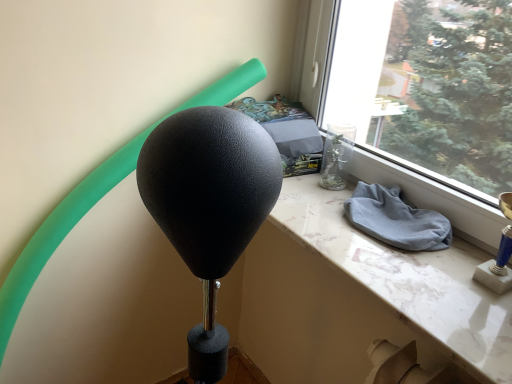
The width and height of the screenshot is (512, 384). Describe the element at coordinates (396, 219) in the screenshot. I see `gray cotton cloth at window sill` at that location.

Image resolution: width=512 pixels, height=384 pixels. Find the location of `gray cotton cloth at window sill`. gray cotton cloth at window sill is located at coordinates (396, 219).

What do you see at coordinates (361, 298) in the screenshot?
I see `white marble table at center` at bounding box center [361, 298].

You are a GUI agent. You are given a task and a screenshot of the screen. Output one action in this format:
    pyautogui.click(x=<x>, y=<y>)
    Task: Click on the white marble table at center
    The height and width of the screenshot is (384, 512).
    Given the screenshot: What is the action you would take?
    pyautogui.click(x=361, y=298)

From the picture: What is the approximate height of white marble table at center?

white marble table at center is 7.51 centimeters in height.

In order to face white marble table at center, should I rotate leftwards or rightwards?

Rotate right and turn 13.744 degrees.

This screenshot has width=512, height=384. Identify the location of gray cotton cloth at window sill. (396, 219).

Can you confirm if white marble table at center is positioned to the right of gray cotton cloth at window sill?

In fact, white marble table at center is to the left of gray cotton cloth at window sill.

Considering their positions, is white marble table at center located in front of or behind gray cotton cloth at window sill?

white marble table at center is in front of gray cotton cloth at window sill.

Is point (368, 314) in front of point (367, 207)?

No.

From the image's perspective, is white marble table at center below gray cotton cloth at window sill?

Yes, from the image's perspective, white marble table at center is below gray cotton cloth at window sill.

From a real-world perspective, does white marble table at center stand above gray cotton cloth at window sill?

No, from a real-world perspective, white marble table at center is not on top of gray cotton cloth at window sill.

Looking at their sizes, would you say white marble table at center is wider or thinner than gray cotton cloth at window sill?

In the image, white marble table at center appears to be wider than gray cotton cloth at window sill.

Is white marble table at center shorter than gray cotton cloth at window sill?

Correct, white marble table at center is not as tall as gray cotton cloth at window sill.

Considering the sizes of objects white marble table at center and gray cotton cloth at window sill in the image provided, who is bigger, white marble table at center or gray cotton cloth at window sill?

white marble table at center is bigger.

Is white marble table at center positioned beyond the bounds of gray cotton cloth at window sill?

white marble table at center is positioned outside gray cotton cloth at window sill.

Can you see white marble table at center touching gray cotton cloth at window sill?

No, white marble table at center is not making contact with gray cotton cloth at window sill.

Is gray cotton cloth at window sill at the back of white marble table at center?

No, gray cotton cloth at window sill is not at the back of white marble table at center.

How many degrees apart are the facing directions of white marble table at center and gray cotton cloth at window sill?

There is a 0.00025-degree angle between the facing directions of white marble table at center and gray cotton cloth at window sill.

This screenshot has width=512, height=384. In order to click on table in front of the gray cotton cloth at window sill in this screenshot , I will do `click(361, 298)`.

Is gray cotton cloth at window sill to the right of white marble table at center from the viewer's perspective?

Yes.

Considering their positions, is gray cotton cloth at window sill located in front of or behind white marble table at center?

In the image, gray cotton cloth at window sill appears behind white marble table at center.

Which is farther, (401, 216) or (406, 293)?

The point (401, 216) is farther from the camera.

From the image's perspective, is gray cotton cloth at window sill beneath white marble table at center?

Incorrect, from the image's perspective, gray cotton cloth at window sill is higher than white marble table at center.

From a real-world perspective, is gray cotton cloth at window sill under white marble table at center?

No, from a real-world perspective, gray cotton cloth at window sill is not beneath white marble table at center.

Which object is thinner, gray cotton cloth at window sill or white marble table at center?

Thinner between the two is gray cotton cloth at window sill.

From their relative heights in the image, would you say gray cotton cloth at window sill is taller or shorter than white marble table at center?

Considering their sizes, gray cotton cloth at window sill has more height than white marble table at center.

Considering the relative sizes of gray cotton cloth at window sill and white marble table at center in the image provided, is gray cotton cloth at window sill bigger than white marble table at center?

Incorrect, gray cotton cloth at window sill is not larger than white marble table at center.

Is gray cotton cloth at window sill situated inside white marble table at center or outside?

gray cotton cloth at window sill is not enclosed by white marble table at center.

Is gray cotton cloth at window sill not near white marble table at center?

No, there isn't a large distance between gray cotton cloth at window sill and white marble table at center.

Is gray cotton cloth at window sill facing towards white marble table at center?

No, gray cotton cloth at window sill is not oriented towards white marble table at center.

How different are the orientations of gray cotton cloth at window sill and white marble table at center in degrees?

The angle between the facing direction of gray cotton cloth at window sill and the facing direction of white marble table at center is 0.00025 degrees.

The image size is (512, 384). I want to click on table that is in front of the gray cotton cloth at window sill, so click(x=361, y=298).

The image size is (512, 384). Find the location of `cloth above the white marble table at center (from a real-world perspective)`. cloth above the white marble table at center (from a real-world perspective) is located at coordinates (396, 219).

The height and width of the screenshot is (384, 512). Find the location of `table that appears below the gray cotton cloth at window sill (from the image's perspective)`. table that appears below the gray cotton cloth at window sill (from the image's perspective) is located at coordinates (361, 298).